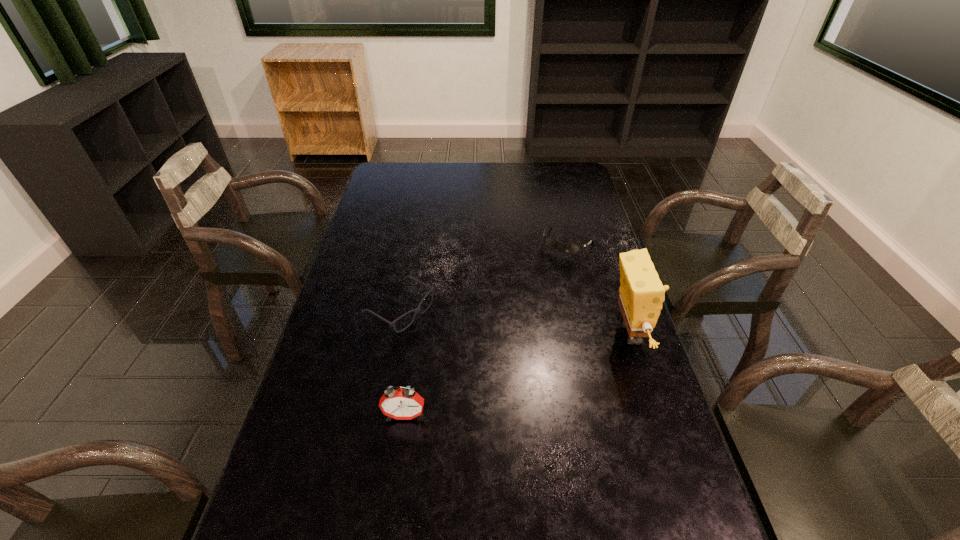
I want to click on the third shortest object, so click(x=401, y=404).

Where is `the nearest object`? Image resolution: width=960 pixels, height=540 pixels. the nearest object is located at coordinates (401, 404).

Where is `sponge`? This screenshot has height=540, width=960. sponge is located at coordinates (641, 296).

I want to click on spectacles, so click(x=392, y=324).

At what (x,y) coordinates should I click in order to perform the action: click on the farthest object. Please return your answer as a coordinate pair (x, y). Looking at the image, I should click on (570, 248).

Find the location of a particular element. This screenshot has width=960, height=540. free space located on the clock face of the third shortest object is located at coordinates (394, 493).

The width and height of the screenshot is (960, 540). In order to click on vacant space located on the front-facing side of the spectacles in this screenshot , I will do `click(462, 347)`.

Locate an element on the screen. vacant space situated 0.230m on the front-facing side of the spectacles is located at coordinates (492, 363).

The width and height of the screenshot is (960, 540). In order to click on free space located on the front-facing side of the spectacles in this screenshot , I will do `click(462, 347)`.

Where is `vacant space situated on the front-facing side of the farthest object`? vacant space situated on the front-facing side of the farthest object is located at coordinates (550, 275).